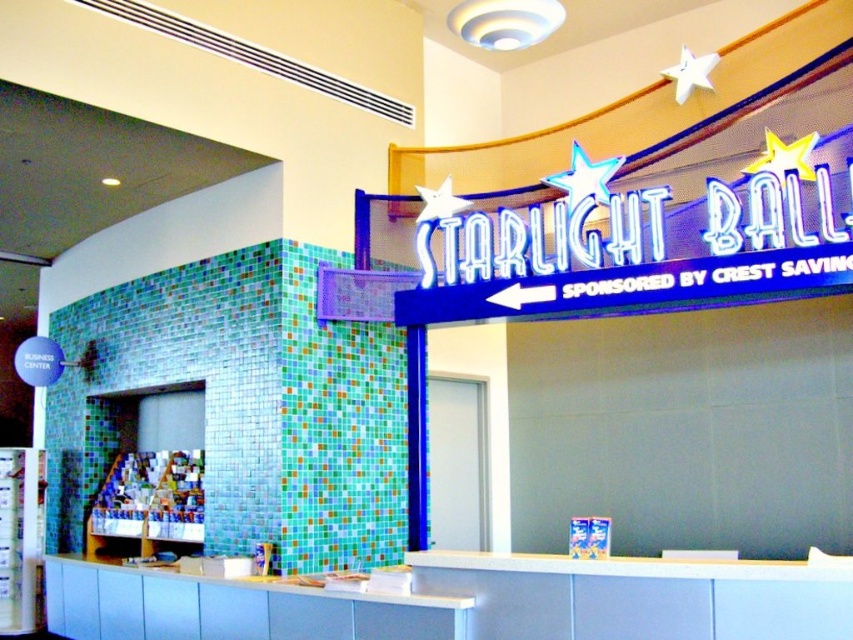
Does metallic yellow star at upper right appear over metallic silver star at upper right?

Actually, metallic yellow star at upper right is below metallic silver star at upper right.

Which is above, metallic yellow star at upper right or metallic silver star at upper right?

metallic silver star at upper right

The width and height of the screenshot is (853, 640). I want to click on metallic yellow star at upper right, so click(x=784, y=156).

Does metallic yellow star at upper right lie in front of metallic silver star at upper center?

That is True.

Can you confirm if metallic yellow star at upper right is thinner than metallic silver star at upper center?

Correct, metallic yellow star at upper right's width is less than metallic silver star at upper center's.

Is point (751, 164) farther from camera compared to point (456, 202)?

That is False.

Identify the location of metallic yellow star at upper right. Image resolution: width=853 pixels, height=640 pixels. (784, 156).

Is neon blue star at upper center closer to camera compared to metallic yellow star at upper right?

That is False.

Is point (598, 195) positioned behind point (781, 177)?

Yes.

Identify the location of neon blue star at upper center. This screenshot has height=640, width=853. (584, 177).